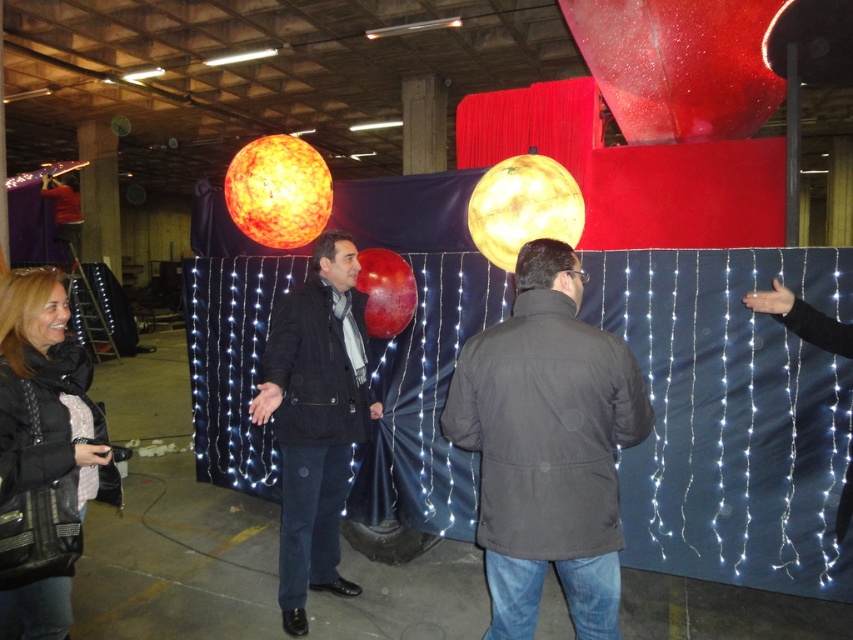
You are a delivery person who needs to place a 2.0 meter long ladder between the black quilted leather jacket at lower left and the camera. Is there enough space for the ladder?

The distance between the black quilted leather jacket at lower left and the camera is 1.95 meters, so the ladder cannot be placed there as it is slightly shorter than the required space.

You are standing at the origin point in the image. The coordinates of the dark gray jacket at center are given as point (547, 445). If you want to move towards the dark gray jacket at center, which direction should you go?

Since the coordinates of the dark gray jacket at center are given as point (547, 445), you should move towards the center of the image to reach it.

You are organizing a charity event and need to display two jackets on a mannequin. The mannequin can only hold jackets that are smaller than a certain size. Given that the dark gray jacket at center is larger than the black quilted leather jacket at lower left, which jacket should you choose to ensure it fits on the mannequin?

You should choose the black quilted leather jacket at lower left because it is smaller in size compared to the dark gray jacket at center, making it more likely to fit on the mannequin.